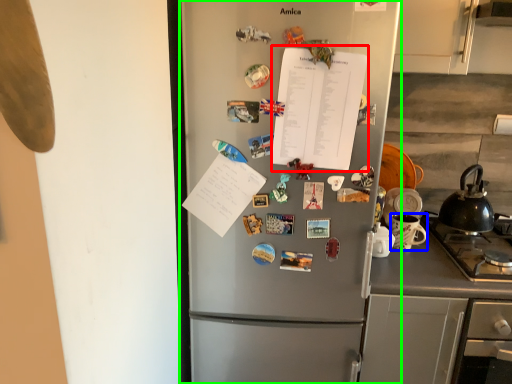
Question: Estimate the real-world distances between objects in this image. Which object is farther from notebook (highlighted by a red box), appliance (highlighted by a blue box) or refrigerator (highlighted by a green box)?

Choices:
 (A) appliance
 (B) refrigerator

Answer: (A)